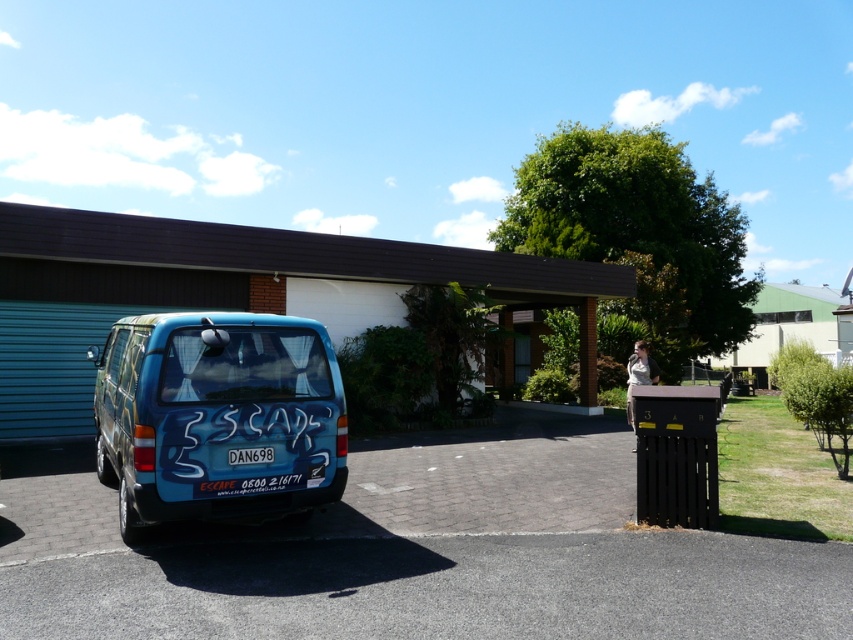
Does matte blue van at left appear on the left side of white plastic license plate at center?

Yes, matte blue van at left is to the left of white plastic license plate at center.

Which is above, matte blue van at left or white plastic license plate at center?

matte blue van at left is higher up.

Which is behind, point (273, 476) or point (265, 458)?

The point (265, 458) is more distant.

Locate an element on the screen. The width and height of the screenshot is (853, 640). matte blue van at left is located at coordinates (218, 417).

Is black asphalt at lower center thinner than matte blue van at left?

No.

In the scene shown: Between black asphalt at lower center and matte blue van at left, which one is positioned lower?

black asphalt at lower center

Find the location of a particular element. black asphalt at lower center is located at coordinates (442, 588).

Who is more distant from viewer, (12,612) or (271,449)?

The point (271,449) is more distant.

Does black asphalt at lower center have a greater width compared to white plastic license plate at center?

Indeed, black asphalt at lower center has a greater width compared to white plastic license plate at center.

At what (x,y) coordinates should I click in order to perform the action: click on black asphalt at lower center. Please return your answer as a coordinate pair (x, y). This screenshot has width=853, height=640. Looking at the image, I should click on (442, 588).

This screenshot has height=640, width=853. I want to click on black asphalt at lower center, so click(442, 588).